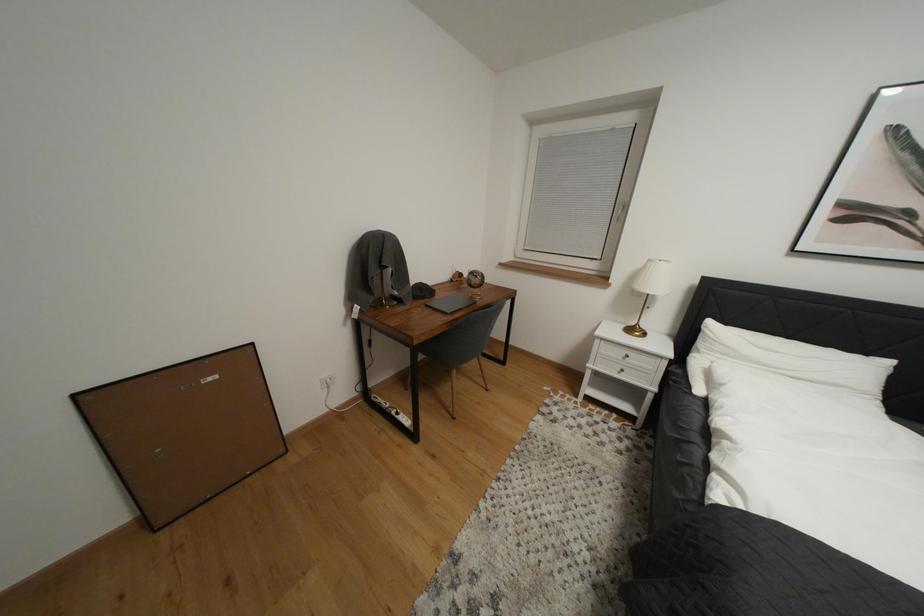
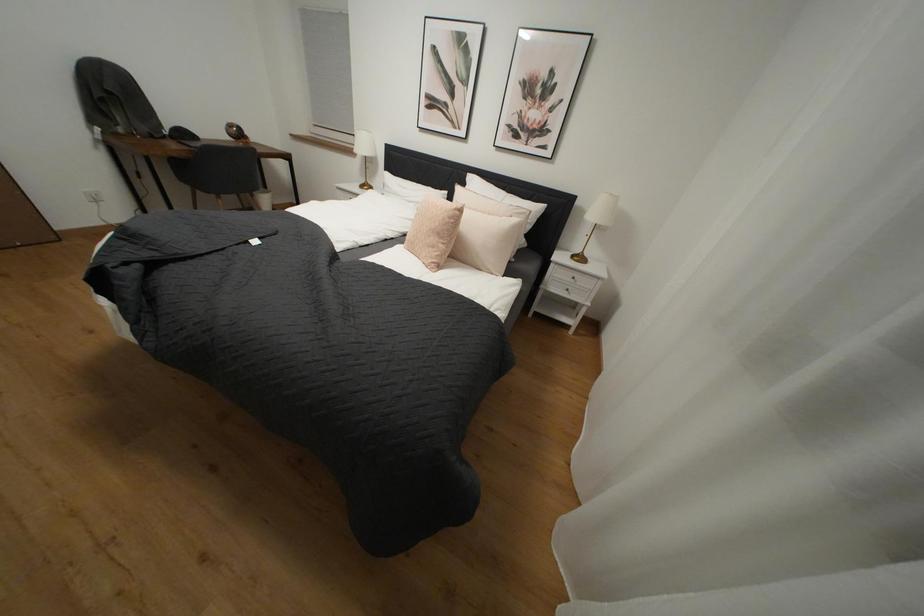
Which direction would the cameraman need to move to produce the second image?

The movement direction of the cameraman is right, backward.